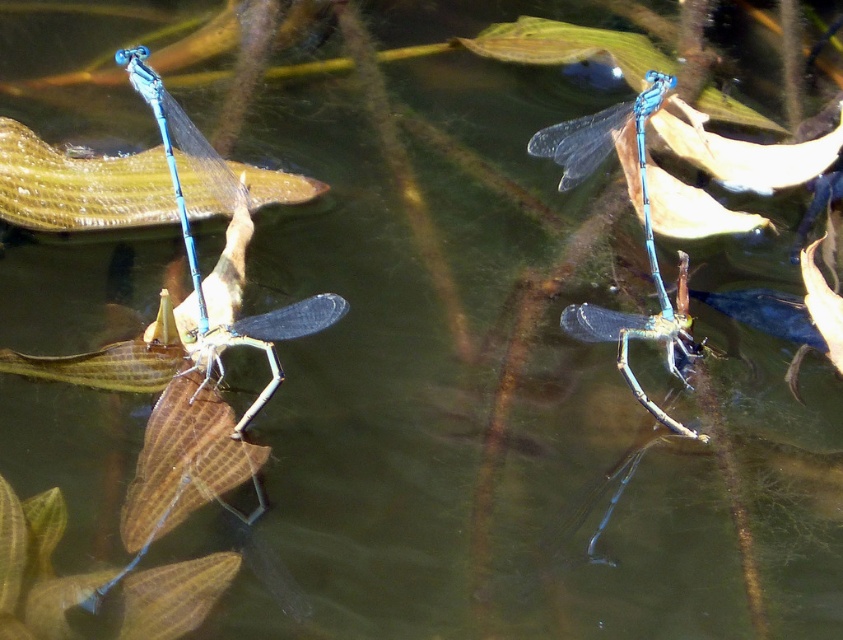
Who is taller, blue translucent wings at center or transparent blue dragonfly at center?

blue translucent wings at center is taller.

Is blue translucent wings at center positioned behind transparent blue dragonfly at center?

No, blue translucent wings at center is closer to the viewer.

Find the location of a particular element. This screenshot has width=843, height=640. blue translucent wings at center is located at coordinates (221, 252).